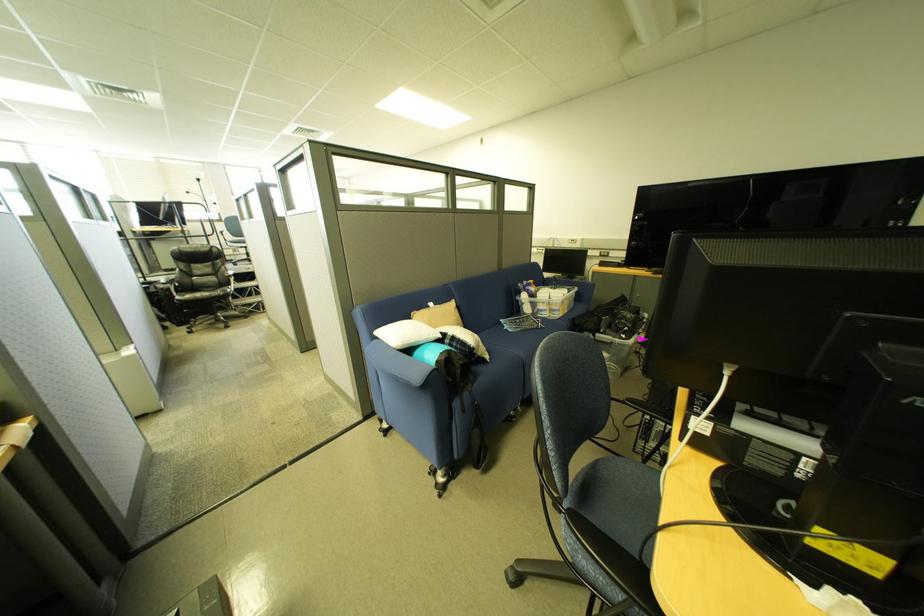
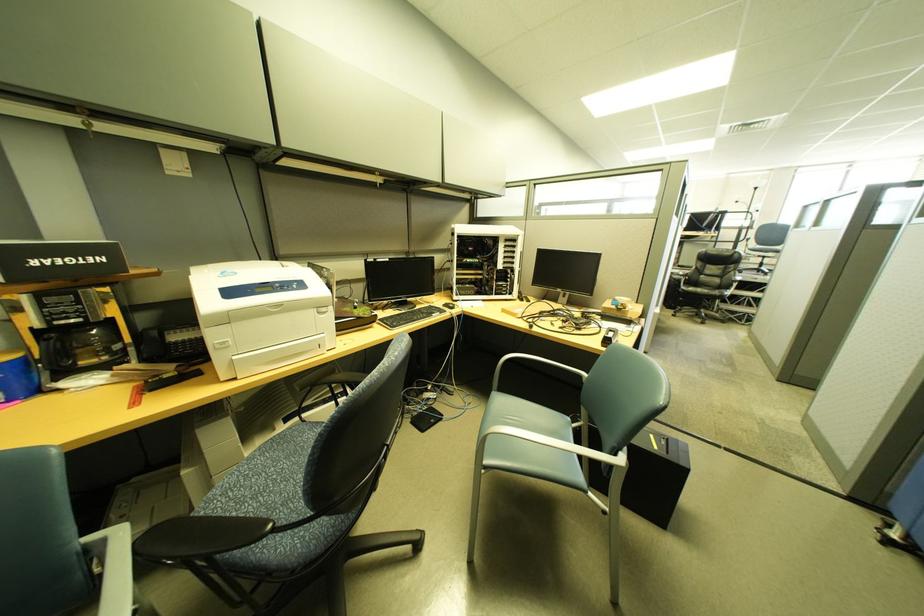
From the picture: First-person continuous shooting, in which direction is the camera rotating?

The camera rotated toward left-down.